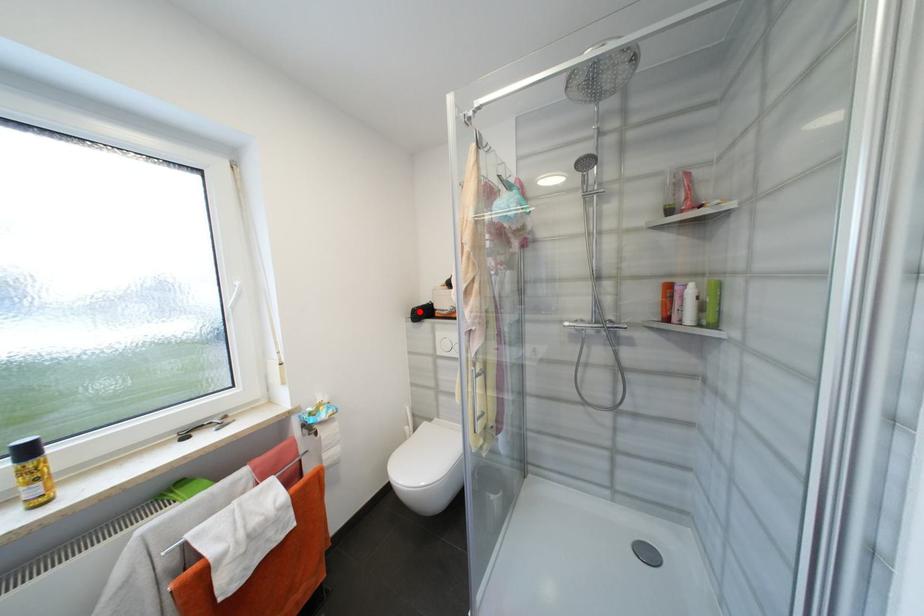
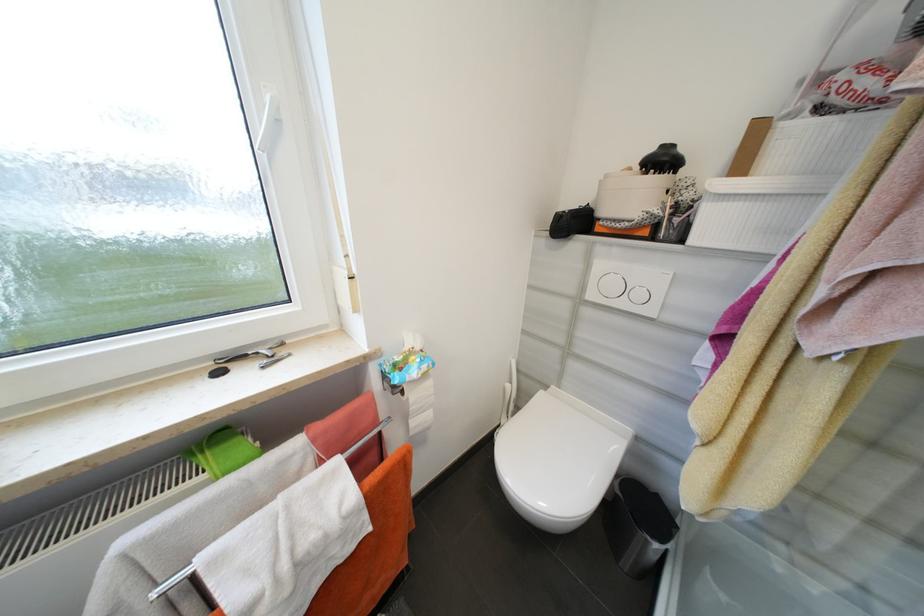
Locate, in the second image, the point that corresponds to the highlighted location in the first image.

(565, 217)